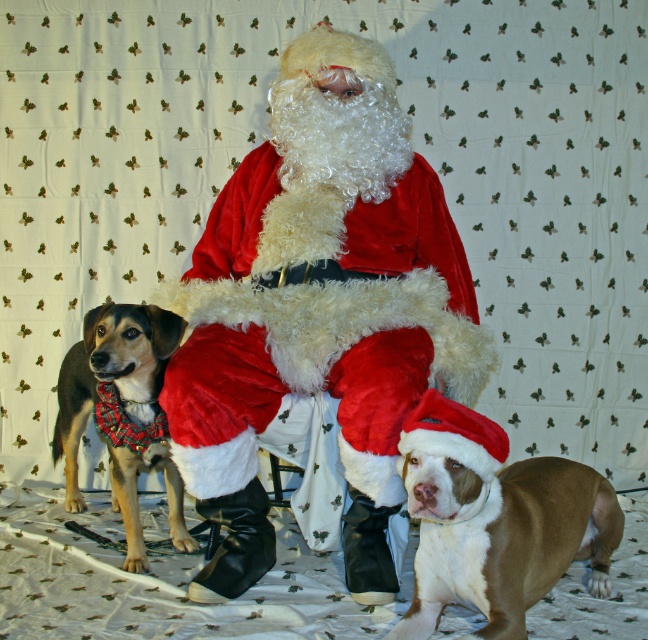
Question: Which object is positioned closest to the plaid fabric dog at left?

Choices:
 (A) brown and white fur at lower right
 (B) velvet santa at center

Answer: (B)

Question: Is velvet santa at center behind brown and white fur at lower right?

Choices:
 (A) yes
 (B) no

Answer: (A)

Question: Among these objects, which one is farthest from the camera?

Choices:
 (A) plaid fabric dog at left
 (B) brown and white fur at lower right

Answer: (A)

Question: Is velvet santa at center smaller than brown and white fur at lower right?

Choices:
 (A) no
 (B) yes

Answer: (A)

Question: Does brown and white fur at lower right appear on the left side of plaid fabric dog at left?

Choices:
 (A) yes
 (B) no

Answer: (B)

Question: Which of these objects is positioned closest to the plaid fabric dog at left?

Choices:
 (A) brown and white fur at lower right
 (B) velvet santa at center

Answer: (B)